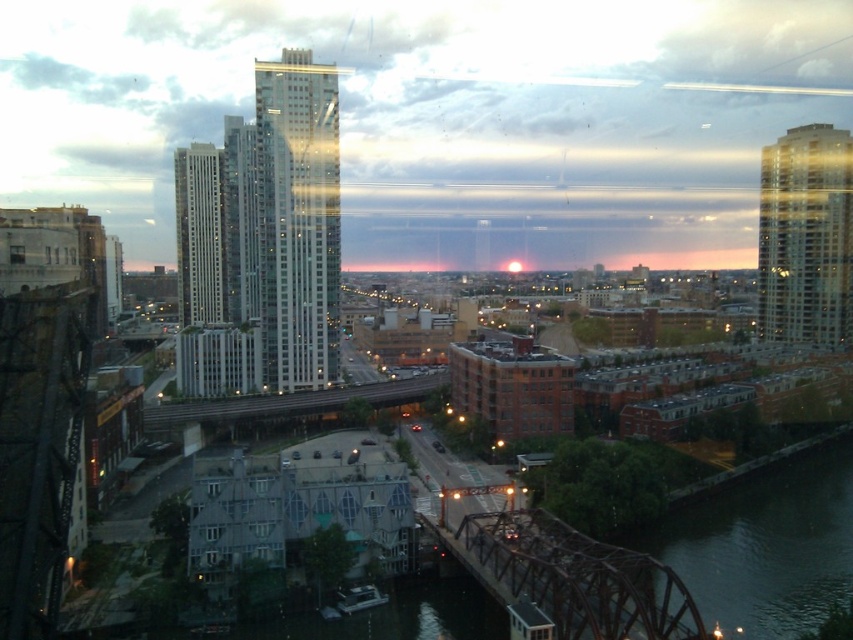
Based on the scene description, where is the glassy reflective skyscraper at center located in terms of coordinates?

The glassy reflective skyscraper at center is located at coordinates point (299, 220).

You are a drone operator who needs to fly a drone between the glassy reflective skyscraper at upper right and the white glass skyscraper at center. The drone has a maximum flight distance of 150 meters. Can the drone safely complete this flight without exceeding its range?

The distance between the glassy reflective skyscraper at upper right and the white glass skyscraper at center is 158.49 meters, which exceeds the drone operator maximum flight range of 150 meters. The drone cannot safely complete this flight without exceeding its range.

You are a city planner reviewing this urban scene. You need to determine if the dark green water at lower right can provide a reflection of the white glass skyscraper at center based on their relative heights. Can it?

The dark green water at lower right is shorter than the white glass skyscraper at center. Since the water is lower in height, it can reflect the skyscraper as reflections occur when the reflective surface is below the object.